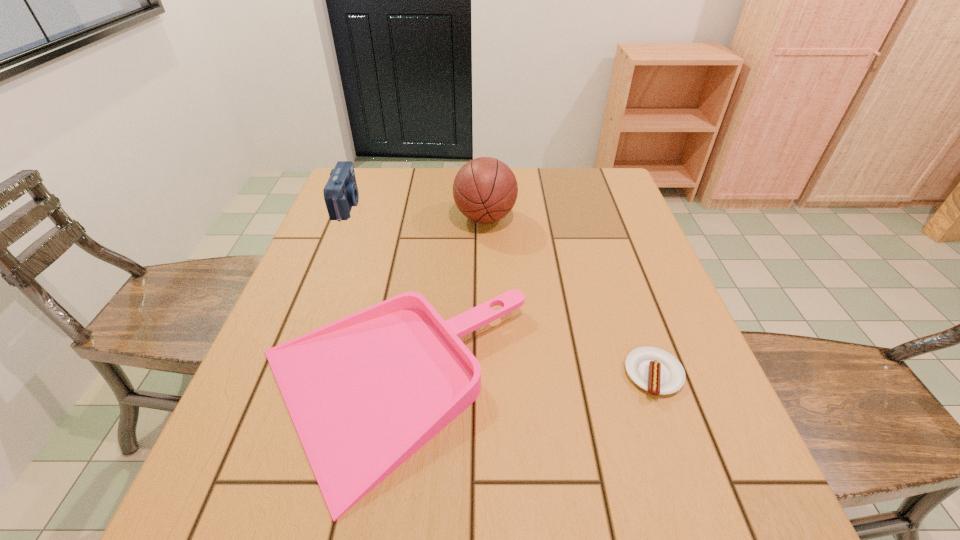
I want to click on unoccupied area between the shortest object and the camera, so click(x=500, y=289).

You are a GUI agent. You are given a task and a screenshot of the screen. Output one action in this format:
    pyautogui.click(x=<x>, y=<y>)
    Task: Click on the free space between the second tallest object and the second shortest object
    The image size is (960, 540).
    Given the screenshot: What is the action you would take?
    pyautogui.click(x=368, y=298)

At what (x,y) coordinates should I click in order to perform the action: click on object that is the second closest to the shortest object. Please return your answer as a coordinate pair (x, y). The image size is (960, 540). Looking at the image, I should click on [x=485, y=189].

The image size is (960, 540). What are the coordinates of `object that ranks as the third closest to the rightmost object` in the screenshot? It's located at (341, 192).

The image size is (960, 540). In order to click on blank area in the image that satisfies the following two spatial constraints: 1. on the back side of the shortest object; 2. on the lens of the camera in this screenshot , I will do 595,205.

Locate an element on the screen. The height and width of the screenshot is (540, 960). vacant space that satisfies the following two spatial constraints: 1. on the lens of the rightmost object; 2. on the left side of the second tallest object is located at coordinates (278, 374).